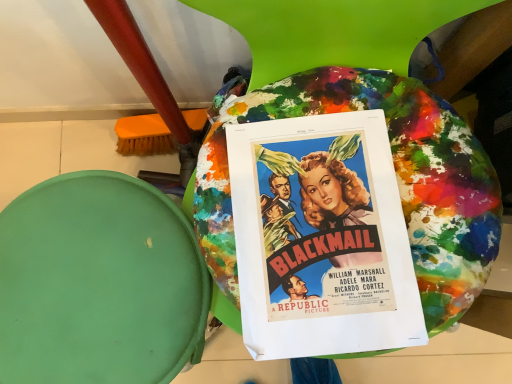
Where is `vacant space situated above vibrant paper poster at center (from a real-world perspective)`? vacant space situated above vibrant paper poster at center (from a real-world perspective) is located at coordinates (320, 230).